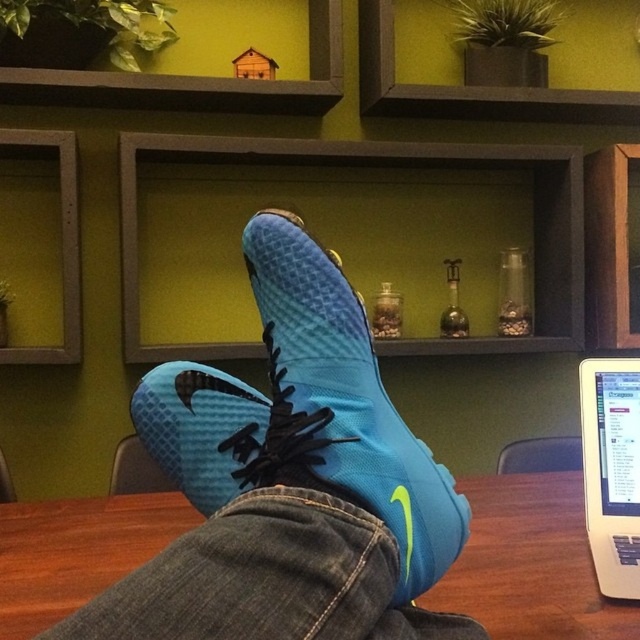
Question: Which object appears closest to the camera in this image?

Choices:
 (A) blue matte/synthetic shoe at center
 (B) blue mesh shoe at center
 (C) white plastic laptop at upper right

Answer: (A)

Question: Can you confirm if wooden table at center is positioned below blue mesh shoe at center?

Choices:
 (A) yes
 (B) no

Answer: (A)

Question: Which object is the closest to the wooden table at center?

Choices:
 (A) blue mesh shoe at center
 (B) blue matte/synthetic shoe at center
 (C) white plastic laptop at upper right

Answer: (B)

Question: Is blue matte/synthetic shoe at center to the left of white plastic laptop at upper right from the viewer's perspective?

Choices:
 (A) yes
 (B) no

Answer: (A)

Question: Where is blue matte/synthetic shoe at center located in relation to wooden table at center in the image?

Choices:
 (A) right
 (B) left

Answer: (A)

Question: Among these objects, which one is nearest to the camera?

Choices:
 (A) blue matte/synthetic shoe at center
 (B) blue mesh shoe at center

Answer: (A)